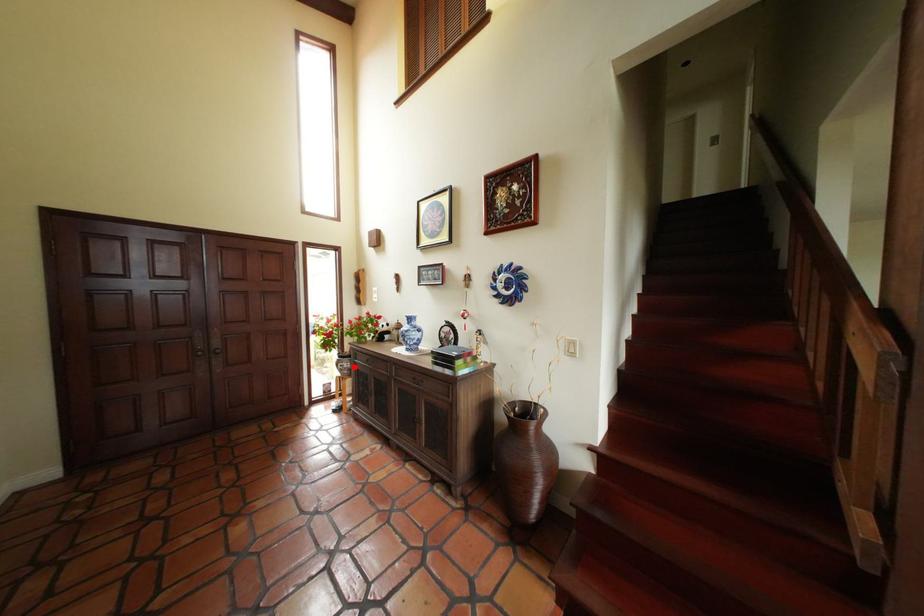
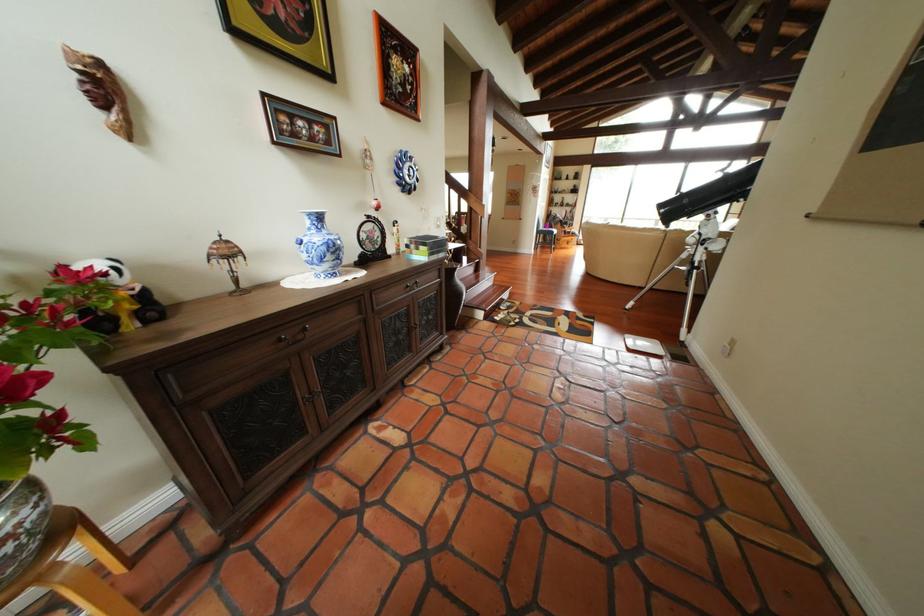
Find the pixel in the second image that matches the highlighted location in the first image.

(11, 546)